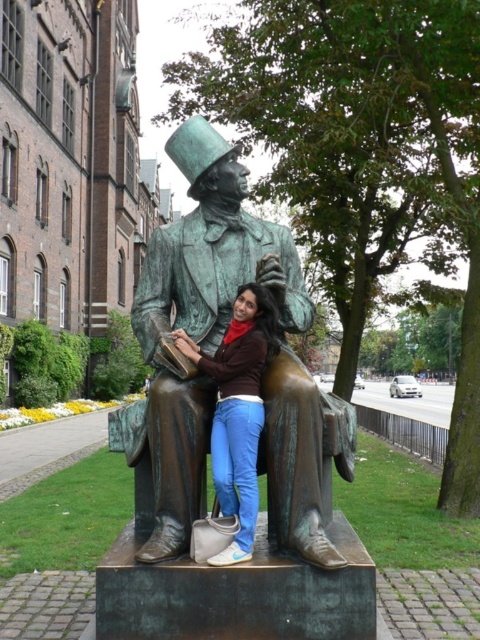
Question: Which point appears farthest from the camera in this image?

Choices:
 (A) (207, 228)
 (B) (255, 470)

Answer: (A)

Question: Is green patina bronze statue at center below matte bronze statue at center?

Choices:
 (A) no
 (B) yes

Answer: (A)

Question: Is green patina bronze statue at center bigger than matte bronze statue at center?

Choices:
 (A) no
 (B) yes

Answer: (B)

Question: Which point is farther to the camera?

Choices:
 (A) (236, 506)
 (B) (190, 285)

Answer: (B)

Question: Can you confirm if green patina bronze statue at center is wider than matte bronze statue at center?

Choices:
 (A) yes
 (B) no

Answer: (A)